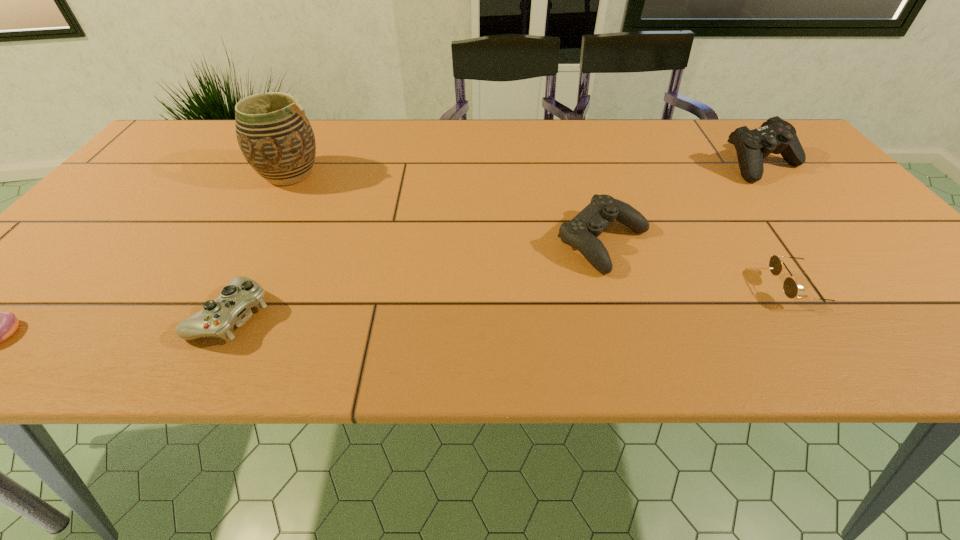
At what (x,y) coordinates should I click in order to perform the action: click on control that stands as the closest to the pottery. Please return your answer as a coordinate pair (x, y). Looking at the image, I should click on (231, 308).

Locate an element on the screen. The width and height of the screenshot is (960, 540). vacant region that satisfies the following two spatial constraints: 1. on the front side of the leftmost control; 2. on the left side of the pottery is located at coordinates (214, 315).

I want to click on vacant space that satisfies the following two spatial constraints: 1. on the back side of the pottery; 2. on the right side of the tallest control, so click(x=294, y=165).